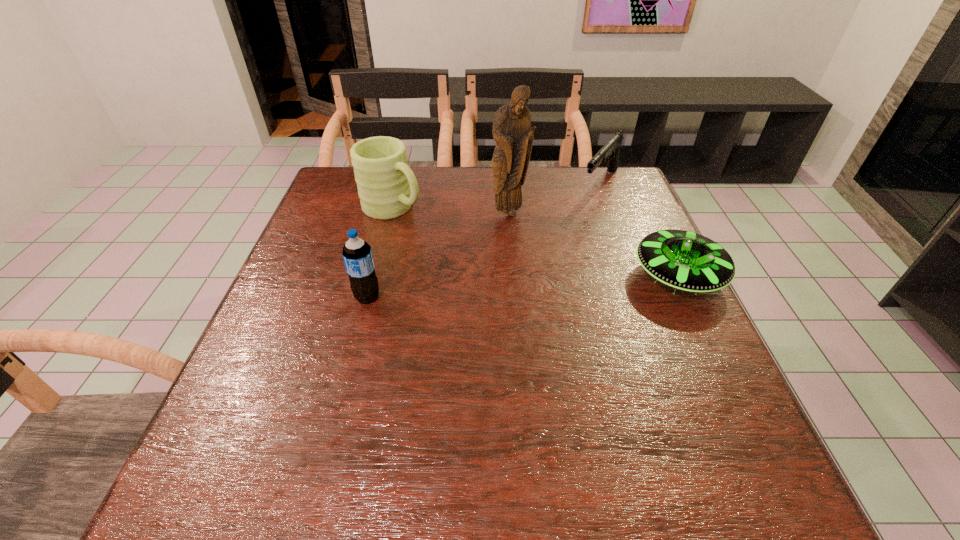
Where is `object that stands as the fourth closest to the second shortest object`? This screenshot has height=540, width=960. object that stands as the fourth closest to the second shortest object is located at coordinates (357, 255).

Locate which object ranks second in proximity to the gun. Please provide its 2D coordinates. Your answer should be formatted as a tuple, i.e. [(x, y)], where the tuple contains the x and y coordinates of a point satisfying the conditions above.

[(686, 261)]

Where is `vacant position in the image that satisfies the following two spatial constraints: 1. on the back side of the tallest object; 2. on the right side of the soda bottle`? vacant position in the image that satisfies the following two spatial constraints: 1. on the back side of the tallest object; 2. on the right side of the soda bottle is located at coordinates [390, 213].

Where is `free space that satisfies the following two spatial constraints: 1. on the back side of the soda bottle; 2. on the right side of the shortest object`? The image size is (960, 540). free space that satisfies the following two spatial constraints: 1. on the back side of the soda bottle; 2. on the right side of the shortest object is located at coordinates (373, 276).

The image size is (960, 540). Find the location of `free spot that satisfies the following two spatial constraints: 1. on the front side of the saucer; 2. on the left side of the mug`. free spot that satisfies the following two spatial constraints: 1. on the front side of the saucer; 2. on the left side of the mug is located at coordinates (375, 276).

Identify the location of vacant space that satisfies the following two spatial constraints: 1. on the front side of the mug; 2. on the left side of the tallest object. The image size is (960, 540). (392, 213).